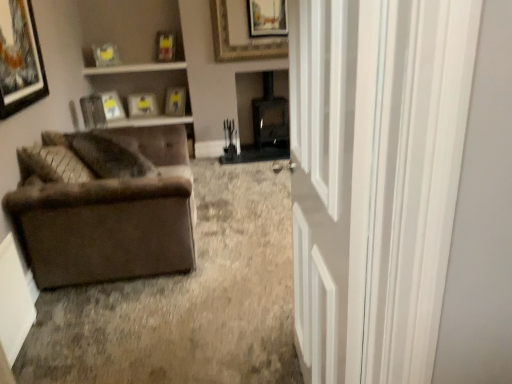
What is the approximate width of matte plastic picture frame at upper center, the 5th picture frame in the front-to-back sequence?

matte plastic picture frame at upper center, the 5th picture frame in the front-to-back sequence, is 7.57 inches wide.

What is the approximate width of white glossy window sill at upper center, positioned as the second window sill in bottom-to-top order?

14.85 inches.

What do you see at coordinates (93, 111) in the screenshot? I see `matte black picture frame at upper left, arranged as the 2th picture frame when viewed from the front` at bounding box center [93, 111].

This screenshot has width=512, height=384. What do you see at coordinates (375, 179) in the screenshot?
I see `white glossy door at right` at bounding box center [375, 179].

Find the location of a particular element. The height and width of the screenshot is (384, 512). matte plastic picture frame at upper center, arranged as the fourth picture frame when viewed from the back is located at coordinates (165, 46).

Is suede brown couch at left aimed at matte yellow picture frame at upper center, the 2th picture frame positioned from the back?

No, suede brown couch at left is not facing towards matte yellow picture frame at upper center, the 2th picture frame positioned from the back.

Considering the relative sizes of suede brown couch at left and matte yellow picture frame at upper center, acting as the 7th picture frame starting from the front, in the image provided, is suede brown couch at left bigger than matte yellow picture frame at upper center, acting as the 7th picture frame starting from the front,?

Yes.

Looking at their sizes, would you say suede brown couch at left is wider or thinner than matte yellow picture frame at upper center, acting as the 7th picture frame starting from the front?

suede brown couch at left is wider than matte yellow picture frame at upper center, acting as the 7th picture frame starting from the front.

Is suede brown couch at left positioned far away from matte yellow picture frame at upper center, the 2th picture frame positioned from the back?

Indeed, suede brown couch at left is not near matte yellow picture frame at upper center, the 2th picture frame positioned from the back.

Could you measure the distance between matte yellow picture frame at upper center, the 2th picture frame positioned from the back, and white wood window sill at upper center, marked as the first window sill in a bottom-to-top arrangement?

matte yellow picture frame at upper center, the 2th picture frame positioned from the back, is 14.21 inches away from white wood window sill at upper center, marked as the first window sill in a bottom-to-top arrangement.

Would you say matte yellow picture frame at upper center, the 2th picture frame positioned from the back, contains white wood window sill at upper center, the 2th window sill viewed from the top?

No, white wood window sill at upper center, the 2th window sill viewed from the top, is not inside matte yellow picture frame at upper center, the 2th picture frame positioned from the back.

Considering the sizes of objects matte yellow picture frame at upper center, acting as the 7th picture frame starting from the front, and white wood window sill at upper center, marked as the first window sill in a bottom-to-top arrangement, in the image provided, who is taller, matte yellow picture frame at upper center, acting as the 7th picture frame starting from the front, or white wood window sill at upper center, marked as the first window sill in a bottom-to-top arrangement,?

Standing taller between the two is matte yellow picture frame at upper center, acting as the 7th picture frame starting from the front.

Can you see matte yellow picture frame at upper center, the 2th picture frame positioned from the back, touching white wood window sill at upper center, the 2th window sill viewed from the top?

No, matte yellow picture frame at upper center, the 2th picture frame positioned from the back, is not in contact with white wood window sill at upper center, the 2th window sill viewed from the top.

From a real-world perspective, is matte plastic picture frame at upper center, arranged as the fourth picture frame when viewed from the back, physically located above or below matte black picture frame at upper left, arranged as the 2th picture frame when viewed from the front?

matte plastic picture frame at upper center, arranged as the fourth picture frame when viewed from the back, is situated higher than matte black picture frame at upper left, arranged as the 2th picture frame when viewed from the front, in the real world.

From the picture: Is the depth of matte plastic picture frame at upper center, arranged as the fourth picture frame when viewed from the back, greater than that of matte black picture frame at upper left, placed as the 7th picture frame when sorted from back to front?

Yes.

Considering the relative positions of matte plastic picture frame at upper center, the 5th picture frame in the front-to-back sequence, and matte black picture frame at upper left, arranged as the 2th picture frame when viewed from the front, in the image provided, is matte plastic picture frame at upper center, the 5th picture frame in the front-to-back sequence, to the right of matte black picture frame at upper left, arranged as the 2th picture frame when viewed from the front, from the viewer's perspective?

Correct, you'll find matte plastic picture frame at upper center, the 5th picture frame in the front-to-back sequence, to the right of matte black picture frame at upper left, arranged as the 2th picture frame when viewed from the front.

Can you tell me how much matte plastic picture frame at upper center, arranged as the fourth picture frame when viewed from the back, and matte black picture frame at upper left, placed as the 7th picture frame when sorted from back to front, differ in facing direction?

matte plastic picture frame at upper center, arranged as the fourth picture frame when viewed from the back, and matte black picture frame at upper left, placed as the 7th picture frame when sorted from back to front, are facing 131 degrees away from each other.

Does gold-framed picture at upper center, the sixth picture frame positioned from the back, have a greater height compared to suede brown couch at left?

No.

Is point (236, 11) closer or farther from the camera than point (179, 184)?

Point (236, 11).

From the image's perspective, is gold-framed picture at upper center, the sixth picture frame positioned from the back, located above or below suede brown couch at left?

Based on their image positions, gold-framed picture at upper center, the sixth picture frame positioned from the back, is located above suede brown couch at left.

Which of these two, suede brown couch at left or white wood window sill at upper center, the 2th window sill viewed from the top, stands shorter?

With less height is white wood window sill at upper center, the 2th window sill viewed from the top.

Is suede brown couch at left bigger than white wood window sill at upper center, marked as the first window sill in a bottom-to-top arrangement?

Yes, suede brown couch at left is bigger than white wood window sill at upper center, marked as the first window sill in a bottom-to-top arrangement.

In the image, is suede brown couch at left on the left side or the right side of white wood window sill at upper center, marked as the first window sill in a bottom-to-top arrangement?

suede brown couch at left is to the right of white wood window sill at upper center, marked as the first window sill in a bottom-to-top arrangement.

Consider the image. Based on their sizes in the image, would you say white glossy window sill at upper center, positioned as the second window sill in bottom-to-top order, is bigger or smaller than matte wooden picture frame at upper left, which is the third picture frame from back to front?

In the image, white glossy window sill at upper center, positioned as the second window sill in bottom-to-top order, appears to be larger than matte wooden picture frame at upper left, which is the third picture frame from back to front.

Considering the relative positions of white glossy window sill at upper center, which appears as the 1th window sill when viewed from the top, and matte wooden picture frame at upper left, which is the sixth picture frame from front to back, in the image provided, is white glossy window sill at upper center, which appears as the 1th window sill when viewed from the top, to the left or to the right of matte wooden picture frame at upper left, which is the sixth picture frame from front to back,?

In the image, white glossy window sill at upper center, which appears as the 1th window sill when viewed from the top, appears on the right side of matte wooden picture frame at upper left, which is the sixth picture frame from front to back.

From a real-world perspective, is white glossy window sill at upper center, which appears as the 1th window sill when viewed from the top, positioned under matte wooden picture frame at upper left, which is the sixth picture frame from front to back, based on gravity?

Incorrect, from a real-world perspective, white glossy window sill at upper center, which appears as the 1th window sill when viewed from the top, is higher than matte wooden picture frame at upper left, which is the sixth picture frame from front to back.

Considering the sizes of objects white glossy window sill at upper center, which appears as the 1th window sill when viewed from the top, and matte wooden picture frame at upper left, which is the third picture frame from back to front, in the image provided, who is thinner, white glossy window sill at upper center, which appears as the 1th window sill when viewed from the top, or matte wooden picture frame at upper left, which is the third picture frame from back to front,?

matte wooden picture frame at upper left, which is the third picture frame from back to front, is thinner.

From the picture: Considering the sizes of matte black picture frame at upper left, placed as the 7th picture frame when sorted from back to front, and matte yellow picture frame at upper left, the fourth picture frame from the front, in the image, is matte black picture frame at upper left, placed as the 7th picture frame when sorted from back to front, wider or thinner than matte yellow picture frame at upper left, the fourth picture frame from the front,?

Considering their sizes, matte black picture frame at upper left, placed as the 7th picture frame when sorted from back to front, looks broader than matte yellow picture frame at upper left, the fourth picture frame from the front.

Looking at this image, which of these two, matte black picture frame at upper left, placed as the 7th picture frame when sorted from back to front, or matte yellow picture frame at upper left, the fourth picture frame from the front, is bigger?

matte black picture frame at upper left, placed as the 7th picture frame when sorted from back to front, is bigger.

Which is behind, matte black picture frame at upper left, arranged as the 2th picture frame when viewed from the front, or matte yellow picture frame at upper left, the 5th picture frame from the back?

matte yellow picture frame at upper left, the 5th picture frame from the back.

Looking at this image, is matte black picture frame at upper left, placed as the 7th picture frame when sorted from back to front, directly adjacent to matte yellow picture frame at upper left, the 5th picture frame from the back?

No, matte black picture frame at upper left, placed as the 7th picture frame when sorted from back to front, is not in contact with matte yellow picture frame at upper left, the 5th picture frame from the back.

Identify the location of studio couch to the left of matte yellow picture frame at upper center, acting as the 7th picture frame starting from the front. The image size is (512, 384). (106, 213).

From the white wood window sill at upper center, the 2th window sill viewed from the top, count 2nd picture frame to the right and point to it. Please provide its 2D coordinates.

[(175, 101)]

Estimate the real-world distances between objects in this image. Which object is further from matte wooden picture frame at upper left, which is the third picture frame from back to front, white wood window sill at upper center, marked as the first window sill in a bottom-to-top arrangement, or matte black picture frame at upper left, marked as the 1th picture frame in a front-to-back arrangement?

The object further to matte wooden picture frame at upper left, which is the third picture frame from back to front, is matte black picture frame at upper left, marked as the 1th picture frame in a front-to-back arrangement.

Considering their positions, is matte yellow picture frame at upper center, the 2th picture frame positioned from the back, positioned closer to suede brown couch at left than matte wooden picture frame at upper left, which is the third picture frame from back to front?

matte wooden picture frame at upper left, which is the third picture frame from back to front, lies closer to suede brown couch at left than the other object.

Based on their spatial positions, is matte yellow picture frame at upper center, the 2th picture frame positioned from the back, or matte plastic picture frame at upper center, arranged as the fourth picture frame when viewed from the back, further from suede brown couch at left?

Based on the image, matte yellow picture frame at upper center, the 2th picture frame positioned from the back, appears to be further to suede brown couch at left.

Looking at the image, which one is located further to gold-framed picture at upper center, the sixth picture frame positioned from the back, matte yellow picture frame at upper left, the fourth picture frame from the front, or matte black picture frame at upper left, placed as the 7th picture frame when sorted from back to front?

matte black picture frame at upper left, placed as the 7th picture frame when sorted from back to front, is positioned further to the anchor gold-framed picture at upper center, the sixth picture frame positioned from the back.

Estimate the real-world distances between objects in this image. Which object is further from matte plastic picture frame at upper center, arranged as the fourth picture frame when viewed from the back, white glossy window sill at upper center, positioned as the second window sill in bottom-to-top order, or suede brown couch at left?

Based on the image, suede brown couch at left appears to be further to matte plastic picture frame at upper center, arranged as the fourth picture frame when viewed from the back.

Based on their spatial positions, is suede brown couch at left or white glossy window sill at upper center, which appears as the 1th window sill when viewed from the top, further from matte yellow picture frame at upper left, the fourth picture frame from the front?

Among the two, suede brown couch at left is located further to matte yellow picture frame at upper left, the fourth picture frame from the front.

Based on their spatial positions, is matte plastic picture frame at upper center, the 5th picture frame in the front-to-back sequence, or gold-framed picture at upper center, the 3th picture frame when ordered from front to back, closer to matte yellow picture frame at upper center, the 2th picture frame positioned from the back?

Among the two, matte plastic picture frame at upper center, the 5th picture frame in the front-to-back sequence, is located nearer to matte yellow picture frame at upper center, the 2th picture frame positioned from the back.

Which object lies nearer to the anchor point matte black picture frame at upper left, marked as the 1th picture frame in a front-to-back arrangement, matte yellow picture frame at upper center, the 2th picture frame positioned from the back, or white wood window sill at upper center, marked as the first window sill in a bottom-to-top arrangement?

white wood window sill at upper center, marked as the first window sill in a bottom-to-top arrangement.

At what (x,y) coordinates should I click in order to perform the action: click on studio couch between white glossy door at right and matte wooden picture frame at upper center, placed as the 8th picture frame when sorted from front to back, along the z-axis. Please return your answer as a coordinate pair (x, y). The width and height of the screenshot is (512, 384). Looking at the image, I should click on (106, 213).

Image resolution: width=512 pixels, height=384 pixels. In order to click on window sill located between white glossy door at right and matte wooden picture frame at upper left, which is the third picture frame from back to front, in the depth direction in this screenshot , I will do `click(135, 68)`.

Where is `studio couch between matte black picture frame at upper left, marked as the 1th picture frame in a front-to-back arrangement, and gold-framed picture at upper center, the sixth picture frame positioned from the back, in the front-back direction`? studio couch between matte black picture frame at upper left, marked as the 1th picture frame in a front-to-back arrangement, and gold-framed picture at upper center, the sixth picture frame positioned from the back, in the front-back direction is located at coordinates (106, 213).

This screenshot has width=512, height=384. I want to click on studio couch between white glossy door at right and matte yellow picture frame at upper center, the 2th picture frame positioned from the back, along the z-axis, so click(106, 213).